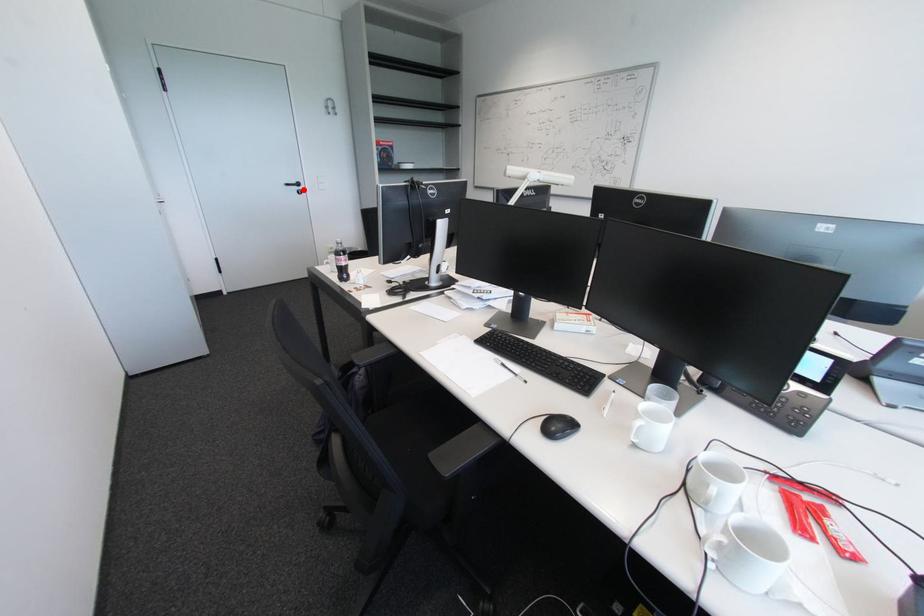
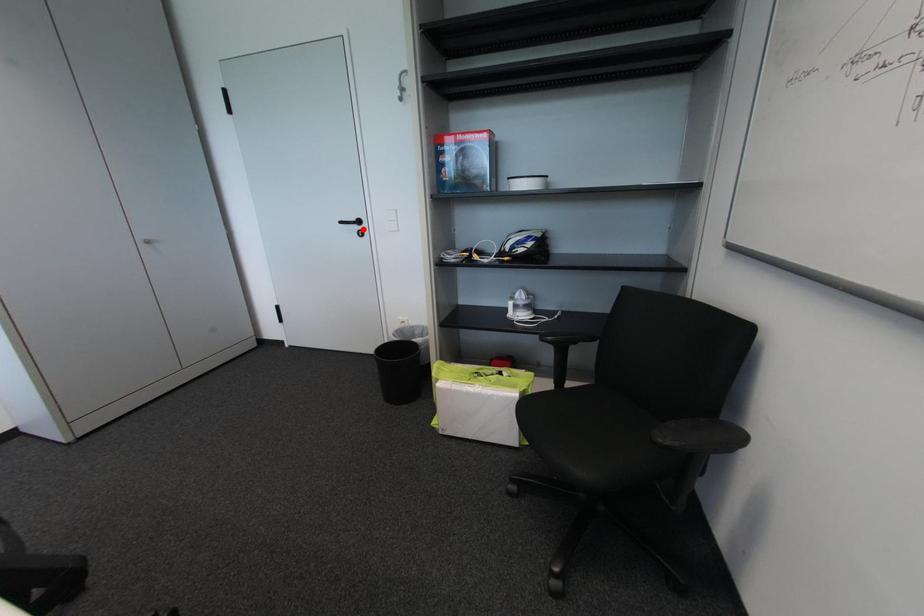
Looking at this image, I am providing you with two images of the same scene from different viewpoints. A red point is marked on the first image and another point is marked on the second image. Is the marked point in image1 the same physical position as the marked point in image2?

Yes